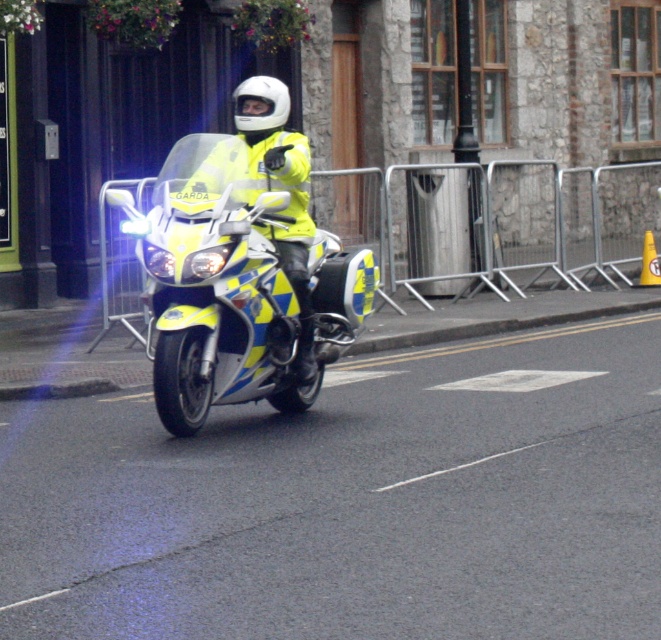
Question: Which object is closer to the camera taking this photo?

Choices:
 (A) yellow matte jacket at center
 (B) yellow reflective motorcycle at center

Answer: (B)

Question: Which point appears farthest from the camera in this image?

Choices:
 (A) (336, 300)
 (B) (268, 90)

Answer: (A)

Question: Is yellow reflective motorcycle at center wider than yellow matte jacket at center?

Choices:
 (A) yes
 (B) no

Answer: (A)

Question: Can you confirm if yellow reflective motorcycle at center is bigger than yellow matte jacket at center?

Choices:
 (A) no
 (B) yes

Answer: (B)

Question: Considering the relative positions of yellow reflective motorcycle at center and yellow matte jacket at center in the image provided, where is yellow reflective motorcycle at center located with respect to yellow matte jacket at center?

Choices:
 (A) left
 (B) right

Answer: (A)